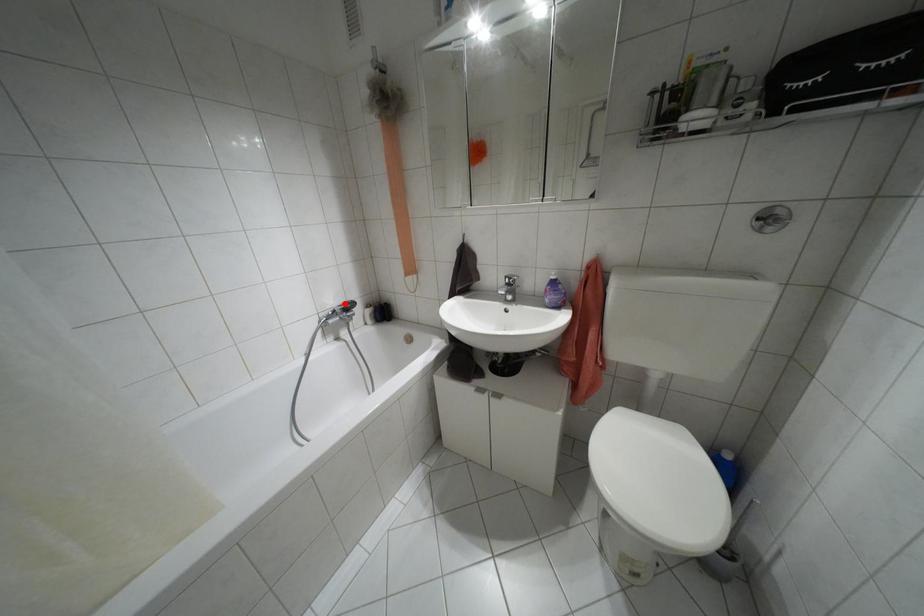
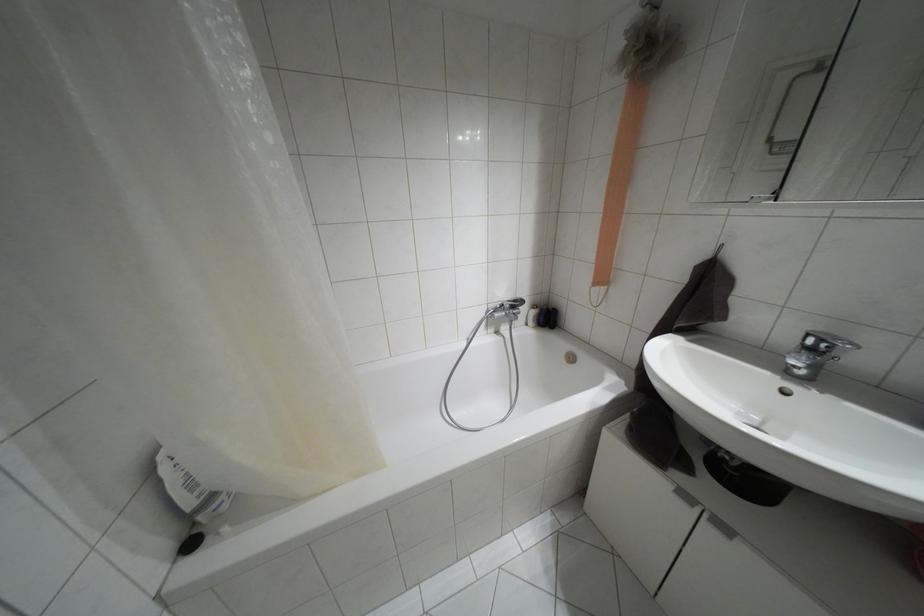
In the second image, find the point that corresponds to the highlighted location in the first image.

(514, 301)